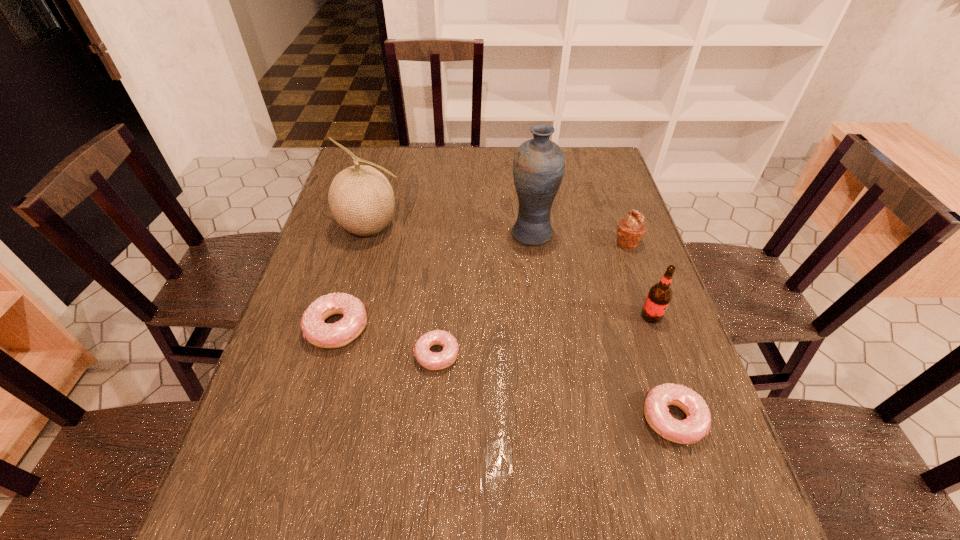
Locate an element on the screen. The image size is (960, 540). cantaloup that is at the left edge is located at coordinates (361, 199).

This screenshot has width=960, height=540. In order to click on doughnut that is at the right edge in this screenshot , I will do `click(697, 424)`.

Locate an element on the screen. muffin that is at the right edge is located at coordinates (631, 230).

You are a GUI agent. You are given a task and a screenshot of the screen. Output one action in this format:
    pyautogui.click(x=<x>, y=<y>)
    Task: Click on the root beer that is at the right edge
    This screenshot has height=540, width=960.
    Given the screenshot: What is the action you would take?
    pyautogui.click(x=659, y=296)

Locate an element on the screen. The height and width of the screenshot is (540, 960). object that is positioned at the near right corner is located at coordinates (697, 424).

Identify the location of free space at the far edge. This screenshot has height=540, width=960. (512, 161).

Where is `vacant area at the near edge of the desktop`? This screenshot has height=540, width=960. vacant area at the near edge of the desktop is located at coordinates (365, 434).

In the image, there is a desktop. Where is `vacant space at the left edge`? Image resolution: width=960 pixels, height=540 pixels. vacant space at the left edge is located at coordinates (322, 382).

In the image, there is a desktop. Where is `vacant space at the right edge`? vacant space at the right edge is located at coordinates (644, 245).

Identify the location of vacant space at the far left corner of the desktop. (359, 154).